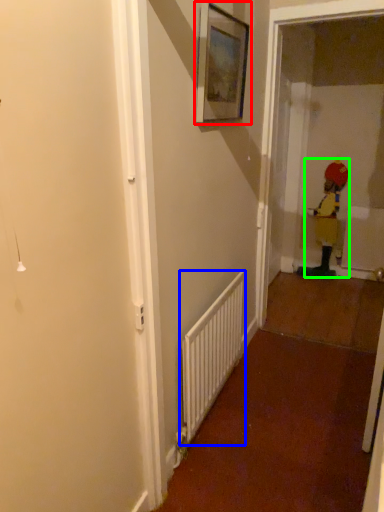
Question: Considering the real-world distances, which object is closest to picture frame (highlighted by a red box)? radiator (highlighted by a blue box) or toddler (highlighted by a green box).

Choices:
 (A) radiator
 (B) toddler

Answer: (A)